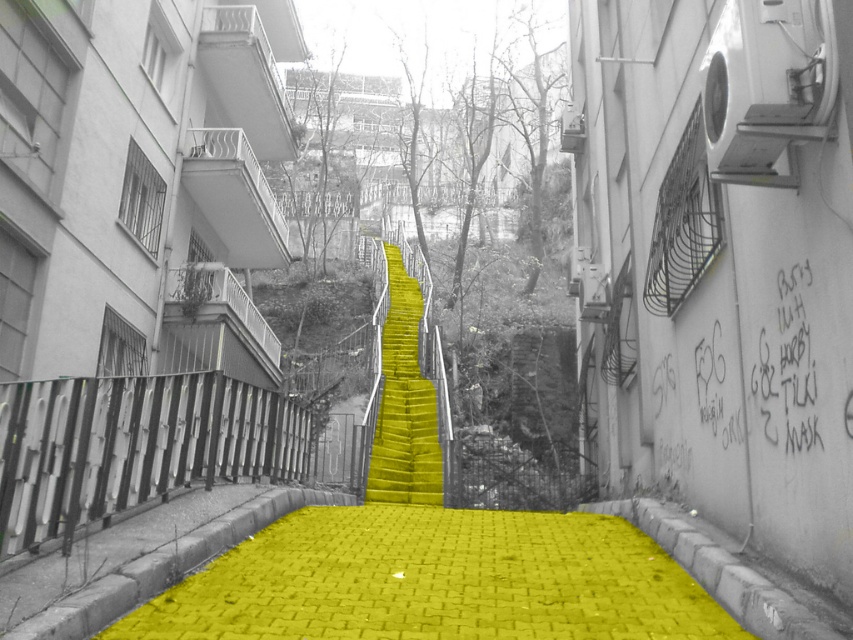
You are a delivery person trying to navigate through the alleyway. You see the yellow brick path at center and the yellow matte stairs at center. Which one is positioned lower in the scene?

The yellow brick path at center is located below yellow matte stairs at center, so it is positioned lower in the scene.

You are a delivery person with a cart that is 2 meters long. You need to move from the yellow brick path at center to the yellow matte stairs at center. Can your cart fit in the space between them?

The distance between the yellow brick path at center and yellow matte stairs at center is 6.61 meters, which is longer than the cart length of 2 meters. Therefore, the cart can fit in the space between them.

Consider the image. You are a delivery person carrying a large package and need to navigate through the yellow brick path at center and the yellow matte stairs at center. Which path is wider to carry your package?

The yellow brick path at center is wider than the yellow matte stairs at center, so it is better to use the yellow brick path at center to carry your package.